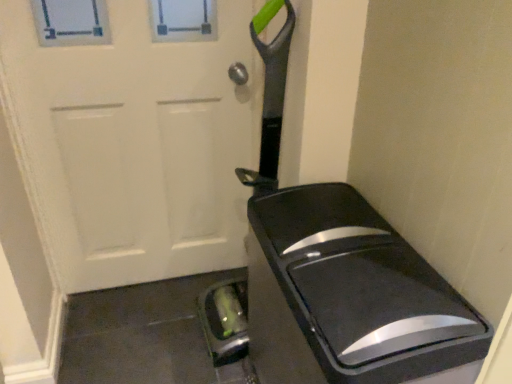
Question: Which is correct: white matte door at center is inside black glossy trash can at center, or outside of it?

Choices:
 (A) outside
 (B) inside

Answer: (A)

Question: In terms of width, does white matte door at center look wider or thinner when compared to black glossy trash can at center?

Choices:
 (A) wide
 (B) thin

Answer: (B)

Question: Is white matte door at center in front of or behind black glossy trash can at center in the image?

Choices:
 (A) behind
 (B) front

Answer: (A)

Question: Visually, is black glossy trash can at center positioned to the left or to the right of white matte door at center?

Choices:
 (A) left
 (B) right

Answer: (B)

Question: Do you think black glossy trash can at center is within white matte door at center, or outside of it?

Choices:
 (A) outside
 (B) inside

Answer: (A)

Question: Considering the positions of black glossy trash can at center and white matte door at center in the image, is black glossy trash can at center wider or thinner than white matte door at center?

Choices:
 (A) wide
 (B) thin

Answer: (A)

Question: From their relative heights in the image, would you say black glossy trash can at center is taller or shorter than white matte door at center?

Choices:
 (A) tall
 (B) short

Answer: (B)